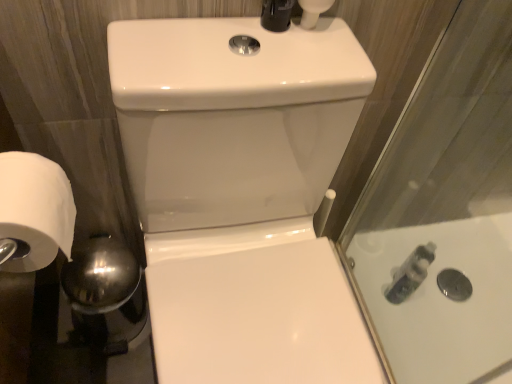
Locate an element on the screen. Image resolution: width=512 pixels, height=384 pixels. free region on the left part of translucent plastic bottle at right is located at coordinates (369, 283).